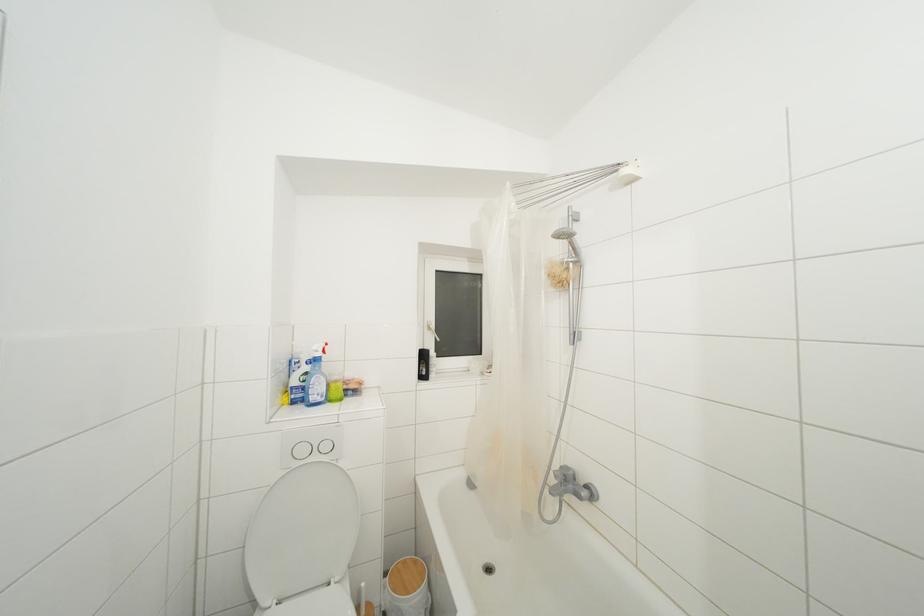
Locate an element on the screen. wooden trash can lid is located at coordinates (407, 577).